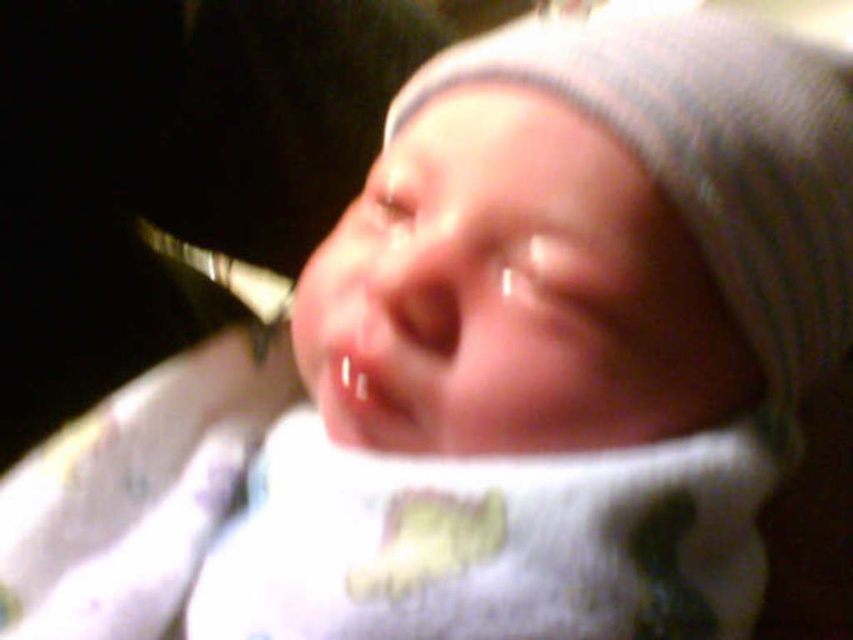
Question: Can you confirm if white knit hat at upper center is bigger than smooth flesh mouth at center?

Choices:
 (A) yes
 (B) no

Answer: (A)

Question: Can you confirm if white knit hat at upper center is thinner than smooth flesh mouth at center?

Choices:
 (A) yes
 (B) no

Answer: (B)

Question: Can you confirm if white knit hat at upper center is bigger than smooth flesh mouth at center?

Choices:
 (A) no
 (B) yes

Answer: (B)